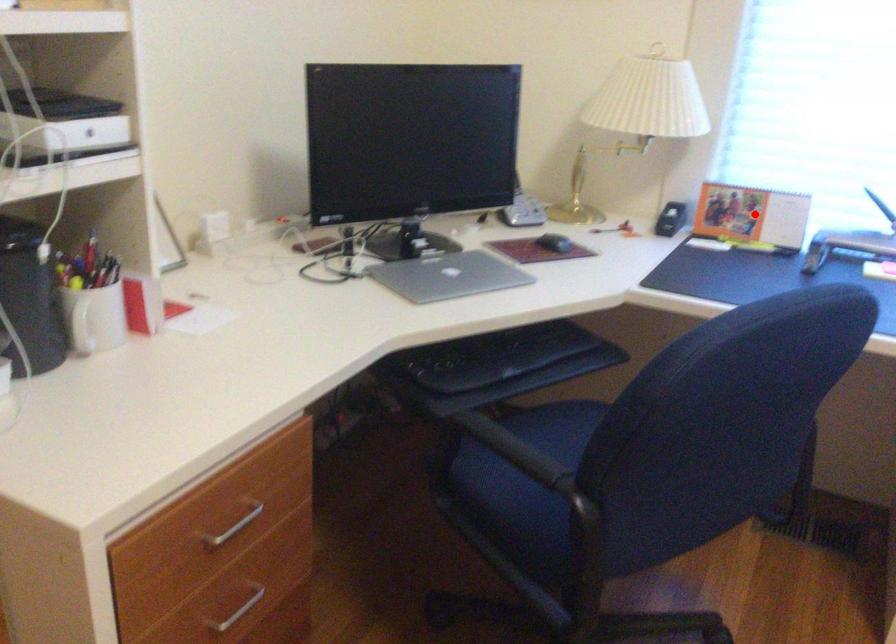
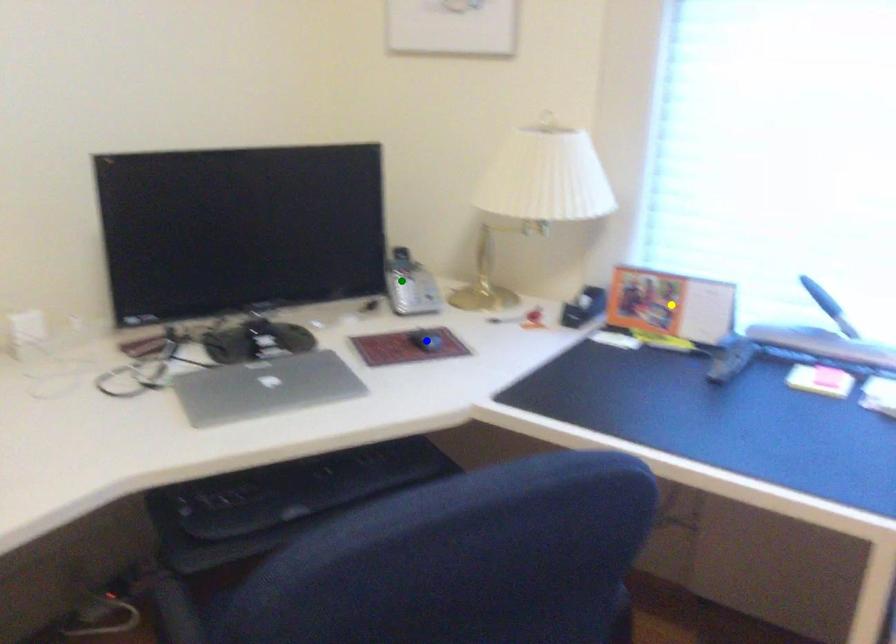
Question: I am providing you with two images of the same scene from different viewpoints. A red point is marked on the first image. You are given multiple points on the second image. Which point in image 2 represents the same 3d spot as the red point in image 1?

Choices:
 (A) yellow point
 (B) blue point
 (C) green point

Answer: (A)